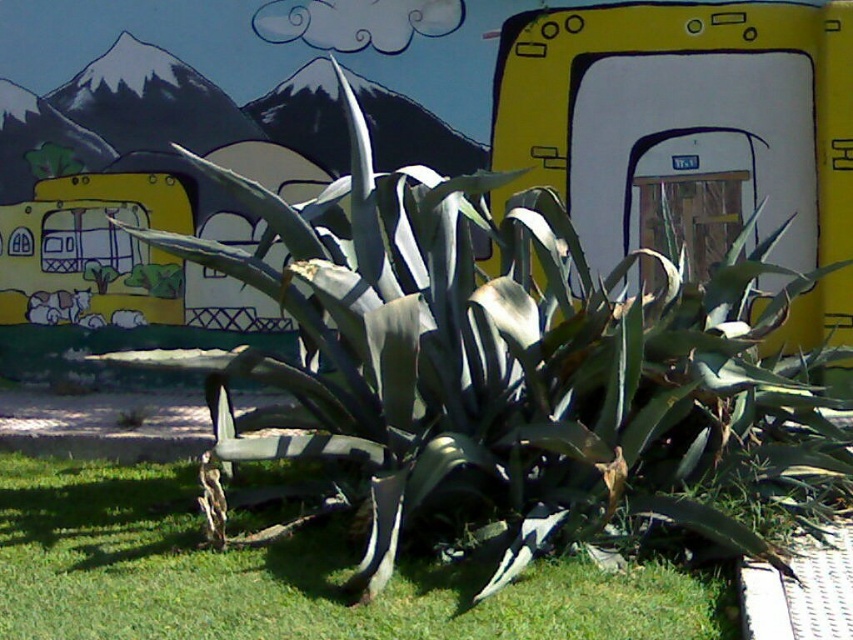
Question: Is green grass at lower center positioned in front of yellow matte school bus at left?

Choices:
 (A) yes
 (B) no

Answer: (A)

Question: Can you confirm if green grass at lower center is thinner than yellow matte school bus at left?

Choices:
 (A) yes
 (B) no

Answer: (B)

Question: Is green grass at lower center bigger than yellow matte school bus at left?

Choices:
 (A) no
 (B) yes

Answer: (B)

Question: Which point is farther to the camera?

Choices:
 (A) yellow matte school bus at left
 (B) green grass at lower center

Answer: (A)